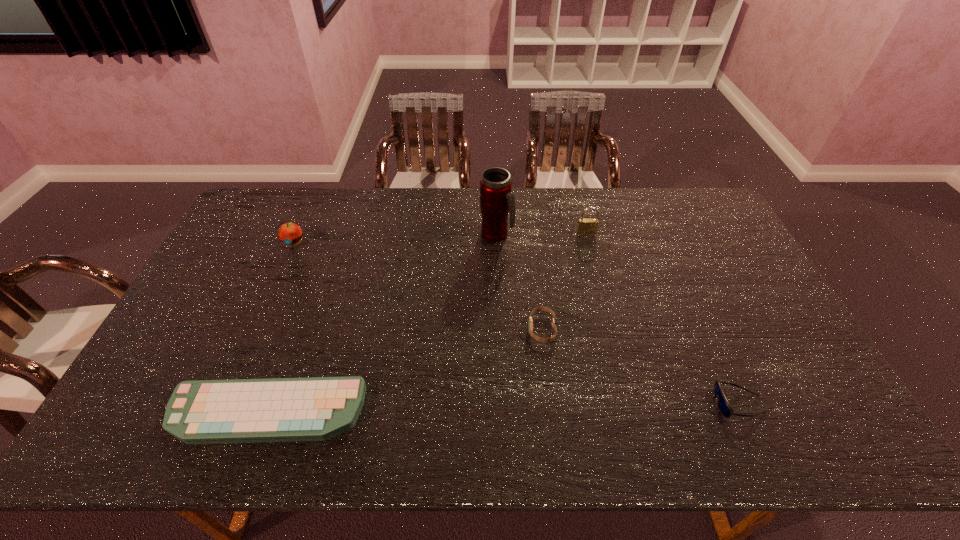
At what (x,y) coordinates should I click in order to perform the action: click on vacant space located on the front-facing side of the second object from right to left. Please return your answer as a coordinate pair (x, y). This screenshot has width=960, height=540. Looking at the image, I should click on (592, 256).

Locate an element on the screen. vacant area located 0.270m on the back of the apple is located at coordinates (316, 190).

Where is `vacant space located 0.240m on the face of the third object from right to left`? This screenshot has width=960, height=540. vacant space located 0.240m on the face of the third object from right to left is located at coordinates (443, 329).

Find the location of a particular element. This screenshot has height=540, width=960. free location located on the face of the third object from right to left is located at coordinates (499, 329).

Where is `vacant space located 0.390m on the face of the third object from right to left`? Image resolution: width=960 pixels, height=540 pixels. vacant space located 0.390m on the face of the third object from right to left is located at coordinates (389, 329).

You are a GUI agent. You are given a task and a screenshot of the screen. Output one action in this format:
    pyautogui.click(x=<x>, y=<y>)
    Task: Click on the vacant space located 0.170m on the front-facing side of the rightmost object
    The width and height of the screenshot is (960, 540).
    Given the screenshot: What is the action you would take?
    pyautogui.click(x=643, y=403)

Locate an element on the screen. The height and width of the screenshot is (540, 960). vacant area situated 0.120m on the front-facing side of the rightmost object is located at coordinates (664, 403).

What are the coordinates of `free space located 0.200m on the front-facing side of the rightmost object` in the screenshot? It's located at (632, 403).

The image size is (960, 540). Identify the location of vacant space located 0.230m on the back of the shortest object. (x=302, y=312).

This screenshot has width=960, height=540. In order to click on object located at the far edge in this screenshot , I will do `click(497, 202)`.